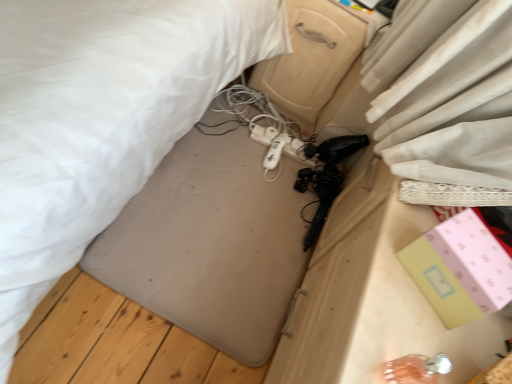
In order to click on vacant area that lies between beige plastic drawer at center and white fabric bed at center in this screenshot , I will do `click(205, 220)`.